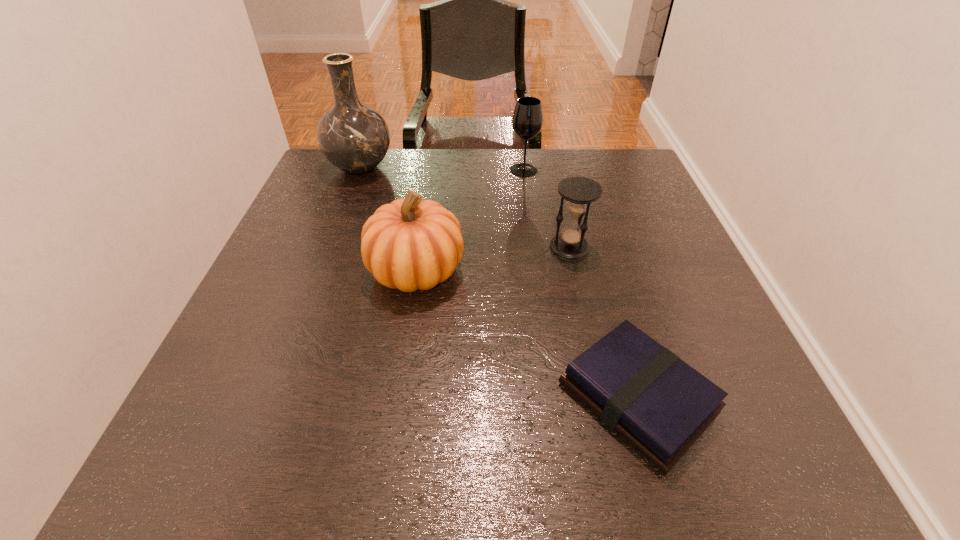
Identify the location of the leftmost object. The image size is (960, 540). (355, 138).

Locate an element on the screen. the tallest object is located at coordinates (355, 138).

Where is `wineglass`? wineglass is located at coordinates (527, 120).

Find the location of a particular element. pumpkin is located at coordinates (410, 244).

I want to click on the second shortest object, so click(579, 192).

Locate an element on the screen. The image size is (960, 540). the shortest object is located at coordinates (658, 404).

The height and width of the screenshot is (540, 960). What are the coordinates of `book` in the screenshot? It's located at (658, 404).

Locate an element on the screen. This screenshot has width=960, height=540. free space located 0.140m on the front of the leftmost object is located at coordinates (342, 218).

Where is `vacant space located on the right of the wineglass`? This screenshot has width=960, height=540. vacant space located on the right of the wineglass is located at coordinates (610, 170).

You are a GUI agent. You are given a task and a screenshot of the screen. Output one action in this format:
    pyautogui.click(x=<x>, y=<y>)
    Task: Click on the vacant region located on the back of the pumpkin
    The width and height of the screenshot is (960, 540).
    Given the screenshot: What is the action you would take?
    pyautogui.click(x=430, y=180)